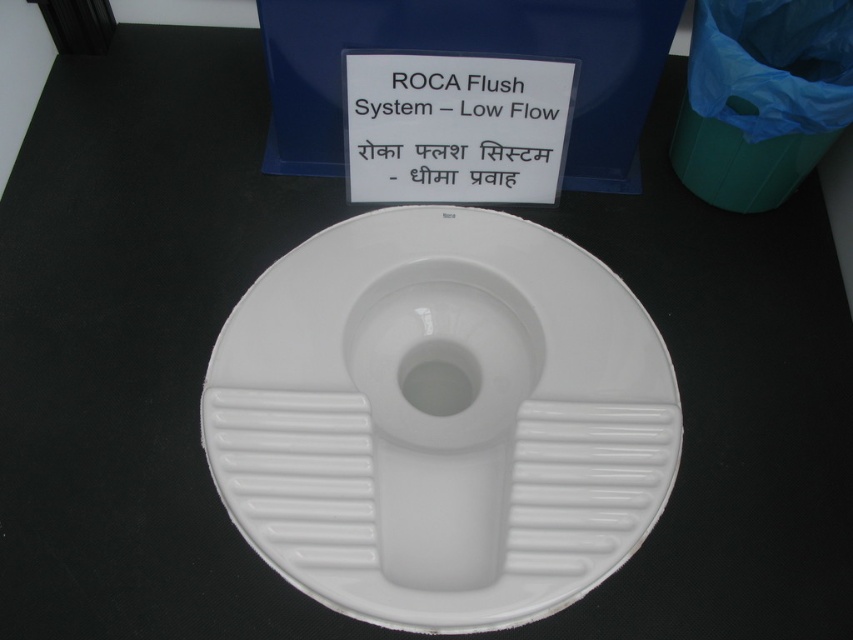
You are positioning a decorative plant on a table. The white glossy toilet bowl at center is in the way. To avoid blocking the bowl, where should you place the plant?

The white glossy toilet bowl at center is located at point (442,413), so place the plant away from that coordinate to avoid blocking it.

You are a plumber inspecting a toilet installation. You notice the white glossy toilet seat at center and the white plastic sign at center. Which object is wider?

The white glossy toilet seat at center is wider than the white plastic sign at center according to the description.

You are a customer in a bathroom fixture store looking at the white glossy toilet seat at center and the white plastic sign at center. Which object is closer to you?

The white glossy toilet seat at center is closer to you because it is in front of the white plastic sign at center.